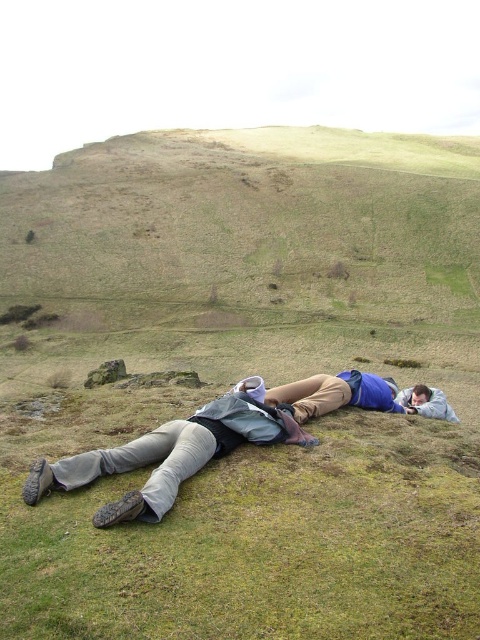
Is khaki pants at center taller than light gray fabric at lower right?

In fact, khaki pants at center may be shorter than light gray fabric at lower right.

Who is positioned more to the right, khaki pants at center or light gray fabric at lower right?

light gray fabric at lower right

Find the location of a particular element. The image size is (480, 640). khaki pants at center is located at coordinates (211, 440).